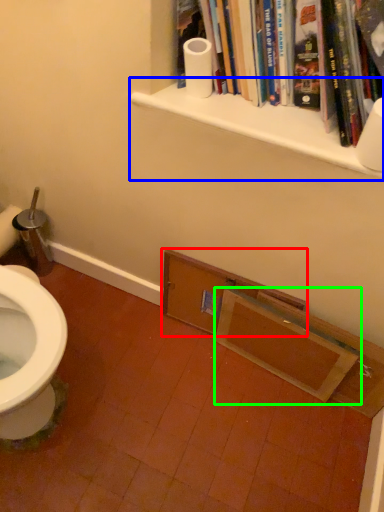
Question: Which object is the farthest from shelf (highlighted by a red box)? Choose among these: shelf (highlighted by a blue box) or medicine cabinet (highlighted by a green box).

Choices:
 (A) shelf
 (B) medicine cabinet

Answer: (A)